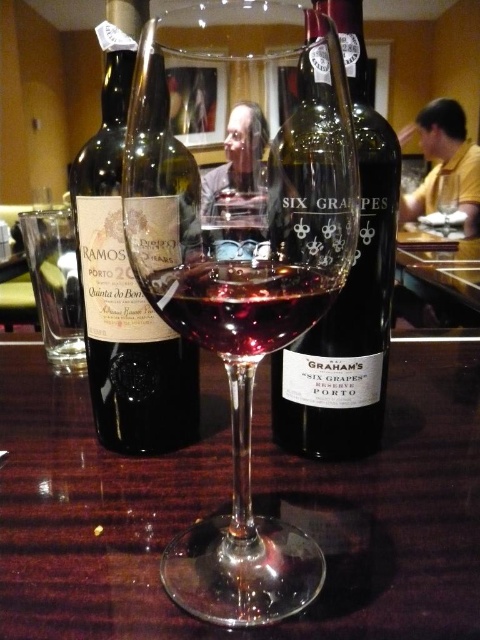
Question: Is transparent glass wine glass at center closer to camera compared to black matte bottle at center?

Choices:
 (A) no
 (B) yes

Answer: (B)

Question: Can you confirm if black matte bottle at center is positioned to the right of translucent glass at center?

Choices:
 (A) yes
 (B) no

Answer: (A)

Question: Which point is closer to the camera taking this photo?

Choices:
 (A) click(x=112, y=12)
 (B) click(x=303, y=378)
 (C) click(x=347, y=205)
 (D) click(x=294, y=268)

Answer: (D)

Question: Is glossy wood table at center to the right of translucent glass at center from the viewer's perspective?

Choices:
 (A) yes
 (B) no

Answer: (B)

Question: Which object appears closest to the camera in this image?

Choices:
 (A) black matte bottle at center
 (B) dark brown glass bottle at left
 (C) glossy wood table at center
 (D) translucent glass at center

Answer: (B)

Question: Which point is farther from the camera taking this photo?

Choices:
 (A) (87, 220)
 (B) (369, 305)

Answer: (B)